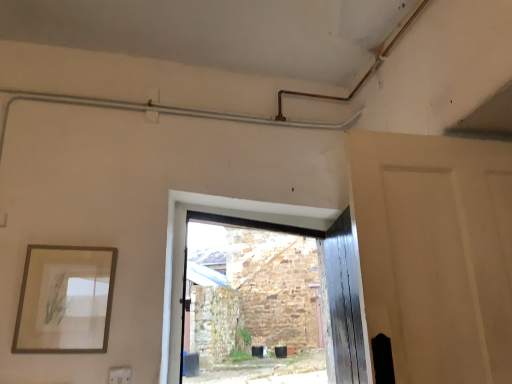
Question: Is matte white door at right bigger than white plastic electric outlet at lower left?

Choices:
 (A) yes
 (B) no

Answer: (A)

Question: Can we say matte white door at right lies outside white plastic electric outlet at lower left?

Choices:
 (A) yes
 (B) no

Answer: (A)

Question: Does matte white door at right appear on the right side of white plastic electric outlet at lower left?

Choices:
 (A) no
 (B) yes

Answer: (B)

Question: From the image's perspective, would you say matte white door at right is positioned over white plastic electric outlet at lower left?

Choices:
 (A) yes
 (B) no

Answer: (A)

Question: From the image's perspective, is matte white door at right below white plastic electric outlet at lower left?

Choices:
 (A) yes
 (B) no

Answer: (B)

Question: Considering the relative positions of matte white door at right and white plastic electric outlet at lower left in the image provided, is matte white door at right to the left of white plastic electric outlet at lower left from the viewer's perspective?

Choices:
 (A) no
 (B) yes

Answer: (A)

Question: Is matte white door at right aimed at wooden picture frame at left?

Choices:
 (A) no
 (B) yes

Answer: (A)

Question: From a real-world perspective, is matte white door at right located beneath wooden picture frame at left?

Choices:
 (A) yes
 (B) no

Answer: (B)

Question: From a real-world perspective, does matte white door at right stand above wooden picture frame at left?

Choices:
 (A) yes
 (B) no

Answer: (A)

Question: Is the position of matte white door at right less distant than that of wooden picture frame at left?

Choices:
 (A) yes
 (B) no

Answer: (A)

Question: From the image's perspective, is matte white door at right under wooden picture frame at left?

Choices:
 (A) yes
 (B) no

Answer: (B)

Question: Is matte white door at right shorter than wooden picture frame at left?

Choices:
 (A) no
 (B) yes

Answer: (A)

Question: Does white plastic electric outlet at lower left have a greater width compared to matte white door at right?

Choices:
 (A) yes
 (B) no

Answer: (B)